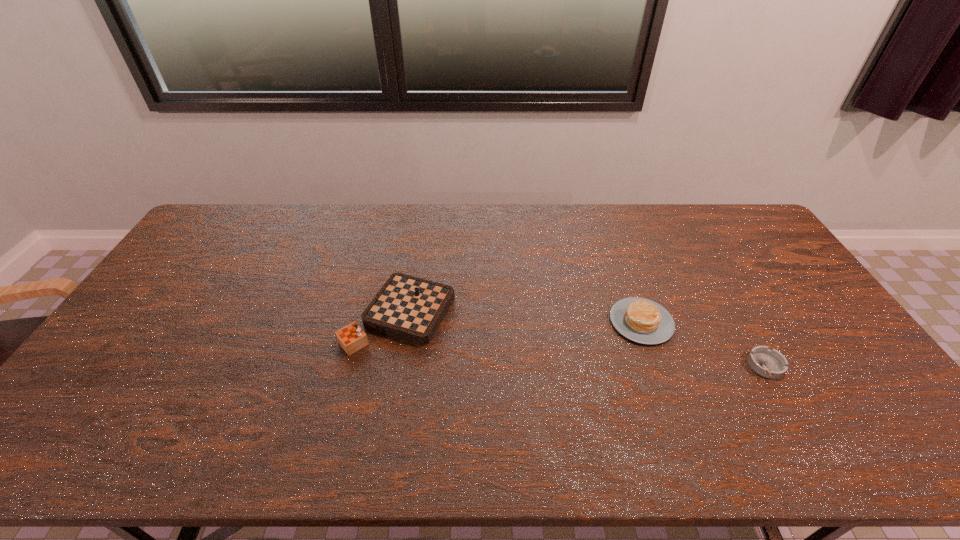
At what (x,y) coordinates should I click in order to perform the action: click on the tallest object. Please return your answer as a coordinate pair (x, y). Looking at the image, I should click on pyautogui.click(x=410, y=308).

Find the location of `the leftmost object`. the leftmost object is located at coordinates (410, 308).

Image resolution: width=960 pixels, height=540 pixels. I want to click on pancake, so click(641, 320).

The height and width of the screenshot is (540, 960). In order to click on the second shortest object in this screenshot , I will do `click(641, 320)`.

The image size is (960, 540). What are the coordinates of `ashtray` in the screenshot? It's located at (768, 363).

You are a GUI agent. You are given a task and a screenshot of the screen. Output one action in this format:
    pyautogui.click(x=<x>, y=<y>)
    Task: Click on the rightmost object
    The width and height of the screenshot is (960, 540).
    Given the screenshot: What is the action you would take?
    pyautogui.click(x=768, y=363)

The width and height of the screenshot is (960, 540). Identify the location of vacant space located on the back of the leftmost object. (417, 219).

You are a GUI agent. You are given a task and a screenshot of the screen. Output one action in this format:
    pyautogui.click(x=<x>, y=<y>)
    Task: Click on the blank space located 0.080m on the right of the second tallest object
    Image resolution: width=960 pixels, height=540 pixels.
    Given the screenshot: What is the action you would take?
    pyautogui.click(x=700, y=322)

Where is `vacant region located 0.320m on the back of the ashtray`? This screenshot has height=540, width=960. vacant region located 0.320m on the back of the ashtray is located at coordinates (712, 273).

At what (x,y) coordinates should I click in order to perform the action: click on free location at the far edge. Please return your answer as a coordinate pair (x, y). Looking at the image, I should click on (350, 223).